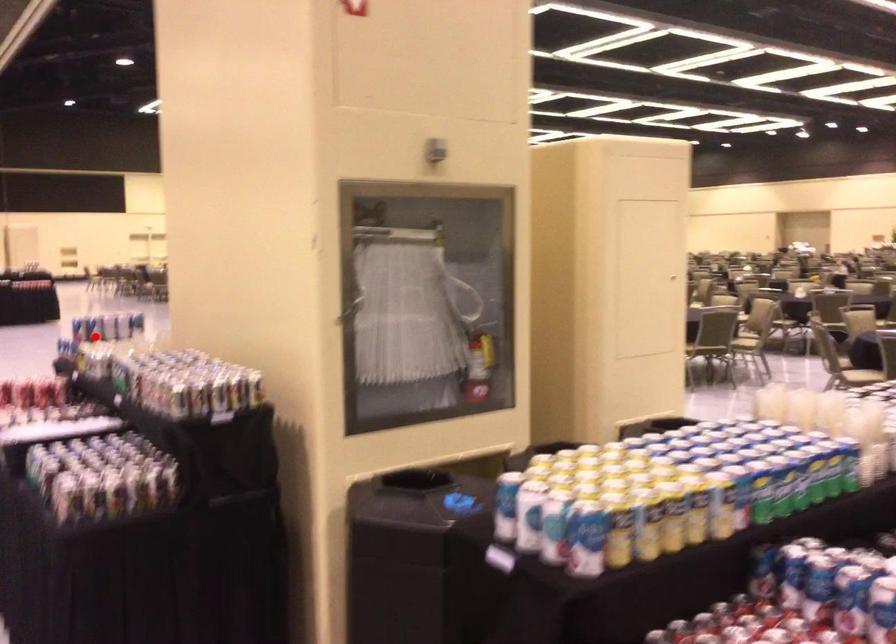
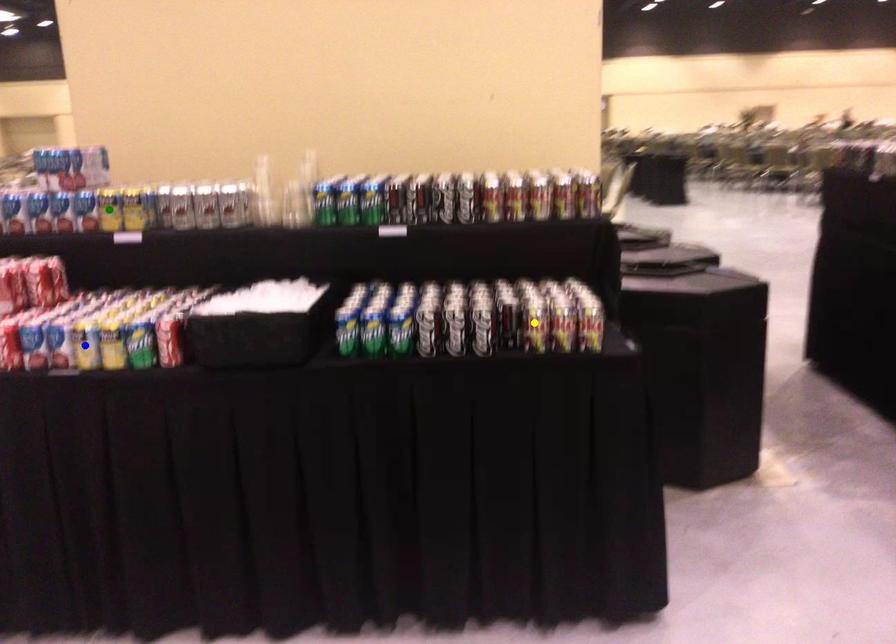
Question: I am providing you with two images of the same scene from different viewpoints. A red point is marked on the first image. You are given multiple points on the second image. In image 2, which mark is for the same physical point as the one in image 1?

Choices:
 (A) blue point
 (B) green point
 (C) yellow point

Answer: (B)